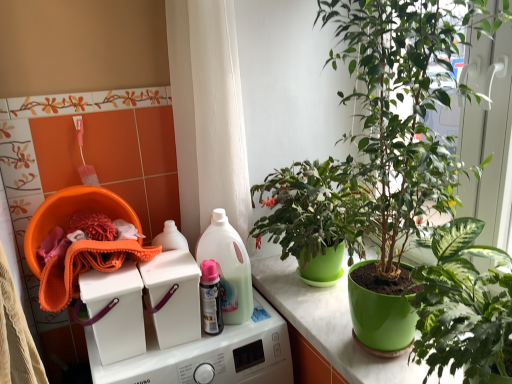
Where is `vacant space in front of pink glossy spray can at center`? vacant space in front of pink glossy spray can at center is located at coordinates (199, 346).